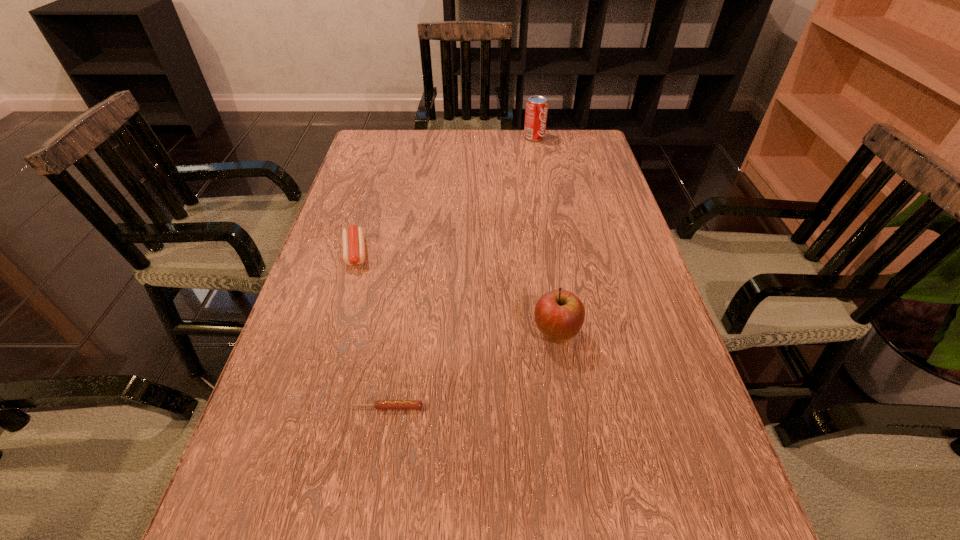
Where is `object present at the far edge`? The width and height of the screenshot is (960, 540). object present at the far edge is located at coordinates (536, 112).

At what (x,y) coordinates should I click in order to perform the action: click on object that is positioned at the right edge. Please return your answer as a coordinate pair (x, y). Looking at the image, I should click on (536, 112).

The width and height of the screenshot is (960, 540). Identify the location of object located in the far right corner section of the desktop. (536, 112).

This screenshot has width=960, height=540. I want to click on free space at the far edge of the desktop, so [542, 148].

This screenshot has height=540, width=960. In the image, there is a desktop. In order to click on free region at the left edge in this screenshot , I will do `click(399, 180)`.

In the image, there is a desktop. What are the coordinates of `free space at the right edge` in the screenshot? It's located at (644, 288).

In the image, there is a desktop. Where is `vacant area at the far right corner`? The image size is (960, 540). vacant area at the far right corner is located at coordinates (586, 130).

Identify the location of free area in between the soda can and the apple. (545, 235).

Identify the location of empty location between the second nearest object and the left sausage. The image size is (960, 540). (456, 293).

Image resolution: width=960 pixels, height=540 pixels. I want to click on vacant space in between the farthest object and the leftmost object, so click(444, 195).